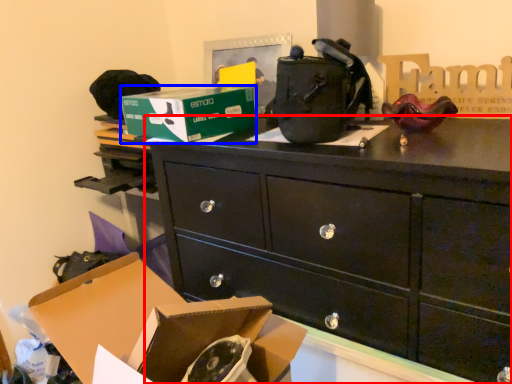
Question: Which object appears closest to the camera in this image, chest of drawers (highlighted by a red box) or box (highlighted by a blue box)?

Choices:
 (A) chest of drawers
 (B) box

Answer: (A)